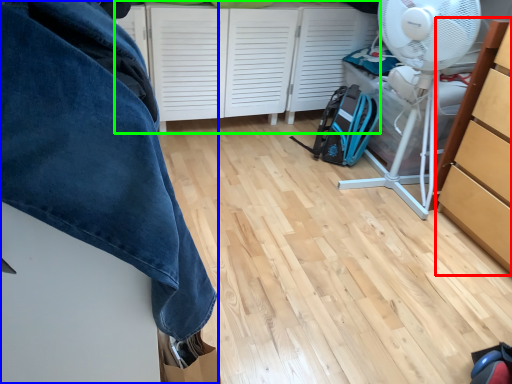
Question: Which object is the farthest from cabinetry (highlighted by a red box)? Choose among these: furniture (highlighted by a blue box) or cabinetry (highlighted by a green box).

Choices:
 (A) furniture
 (B) cabinetry

Answer: (A)